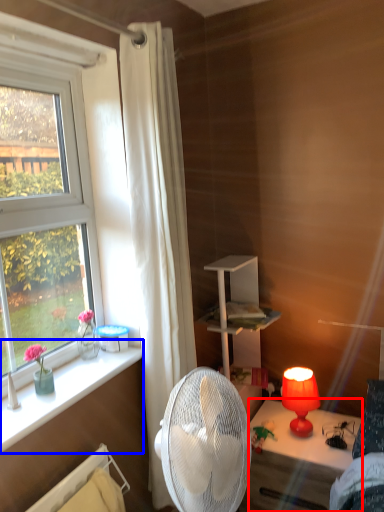
Question: Which point is closer to the camera, desk (highlighted by a red box) or window sill (highlighted by a blue box)?

Choices:
 (A) desk
 (B) window sill

Answer: (B)